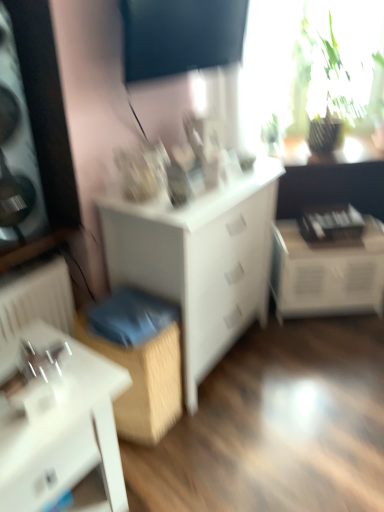
I want to click on empty space that is ontop of white glossy table at lower left, the 1th table from the bottom (from a real-world perspective), so click(46, 374).